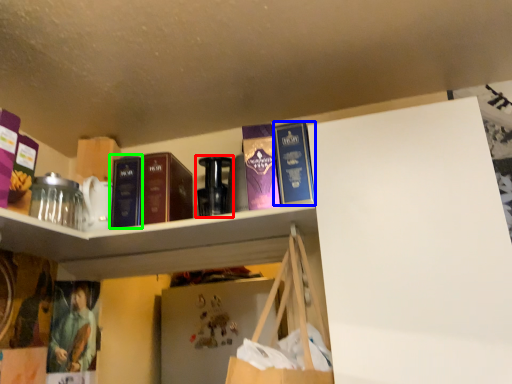
Question: Estimate the real-world distances between objects in this image. Which object is closer to bottle (highlighted by a red box), book (highlighted by a blue box) or book (highlighted by a green box)?

Choices:
 (A) book
 (B) book

Answer: (B)